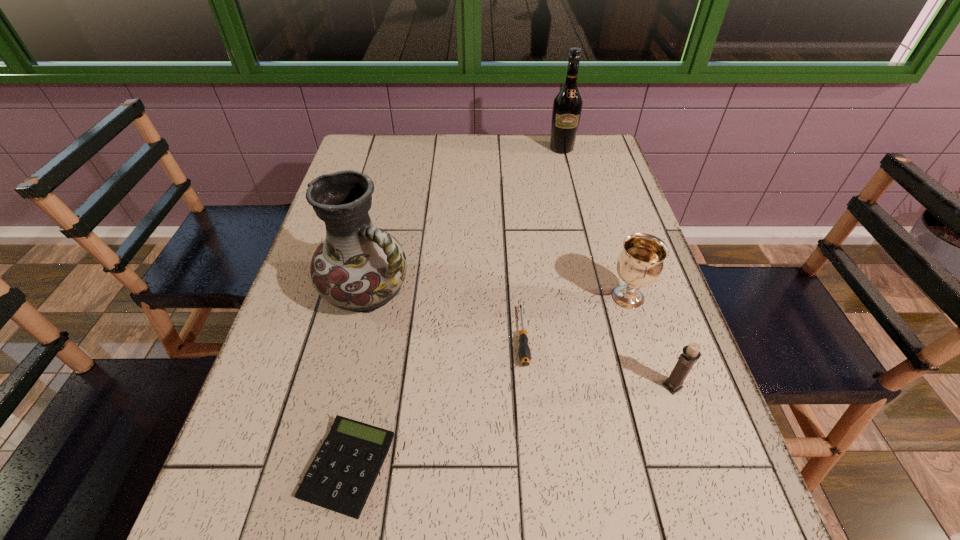
The width and height of the screenshot is (960, 540). What are the coordinates of `vacant area situated 0.110m on the front of the chalice` in the screenshot? It's located at (646, 354).

What are the coordinates of `free location located 0.100m on the front of the fifth farthest object` in the screenshot? It's located at (693, 446).

This screenshot has height=540, width=960. In order to click on vacant space located on the left of the screwdriver in this screenshot , I will do `click(330, 337)`.

Identify the location of free space located 0.110m on the back of the nearest object. (368, 369).

Image resolution: width=960 pixels, height=540 pixels. I want to click on object that is at the far edge, so click(567, 107).

You are a GUI agent. You are given a task and a screenshot of the screen. Output one action in this format:
    pyautogui.click(x=<x>, y=<y>)
    Task: Click on the vase located at the left edge
    
    Given the screenshot: What is the action you would take?
    pyautogui.click(x=358, y=267)

Find the location of a particular element. The width and height of the screenshot is (960, 540). calculator that is at the left edge is located at coordinates (340, 478).

Image resolution: width=960 pixels, height=540 pixels. In order to click on wine bottle that is positioned at the right edge in this screenshot , I will do `click(567, 107)`.

I want to click on chalice that is at the right edge, so click(640, 264).

This screenshot has height=540, width=960. What are the coordinates of `candle holder at the right edge` in the screenshot? It's located at (691, 353).